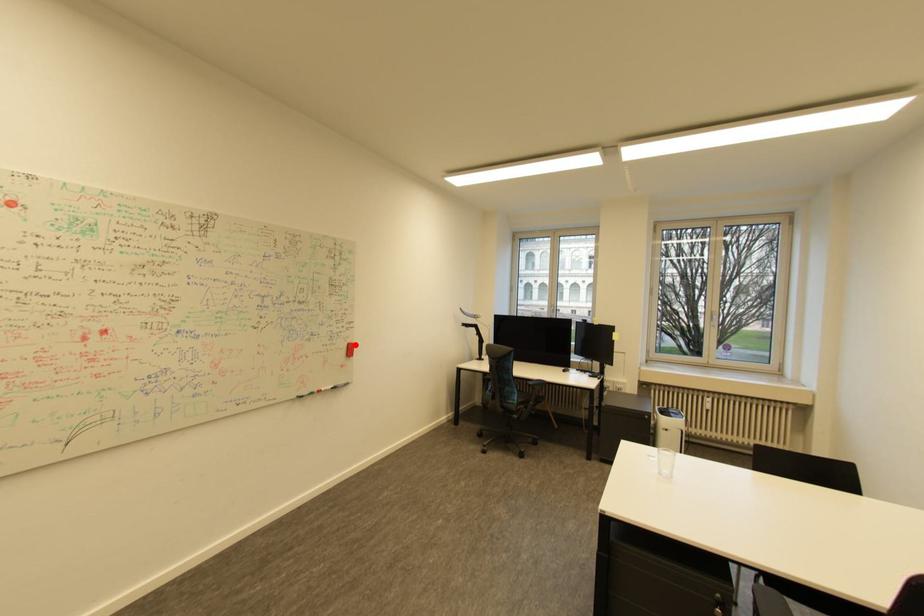
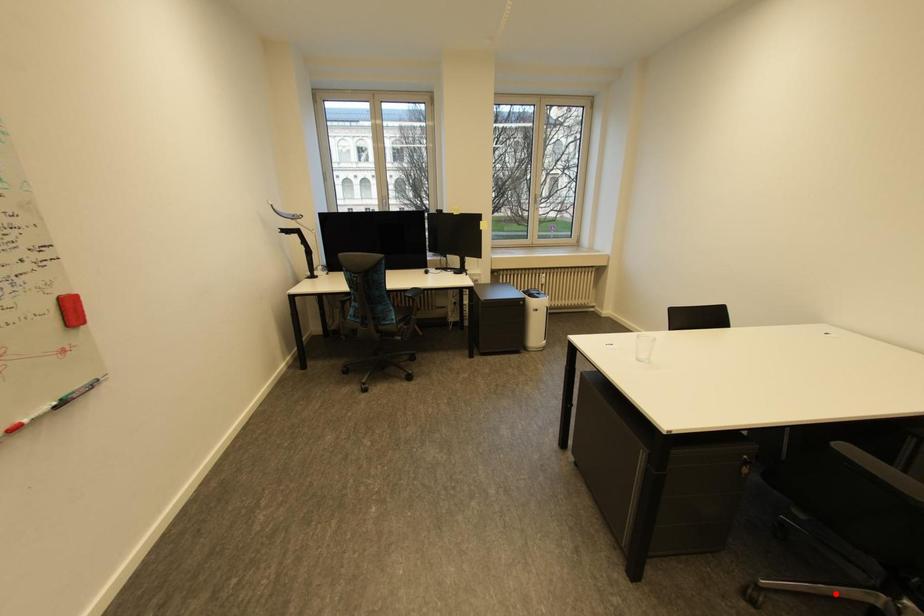
I am providing you with two images of the same scene from different viewpoints. A red point is marked on the first image and another point is marked on the second image. Do the highlighted points in image1 and image2 indicate the same real-world spot?

No